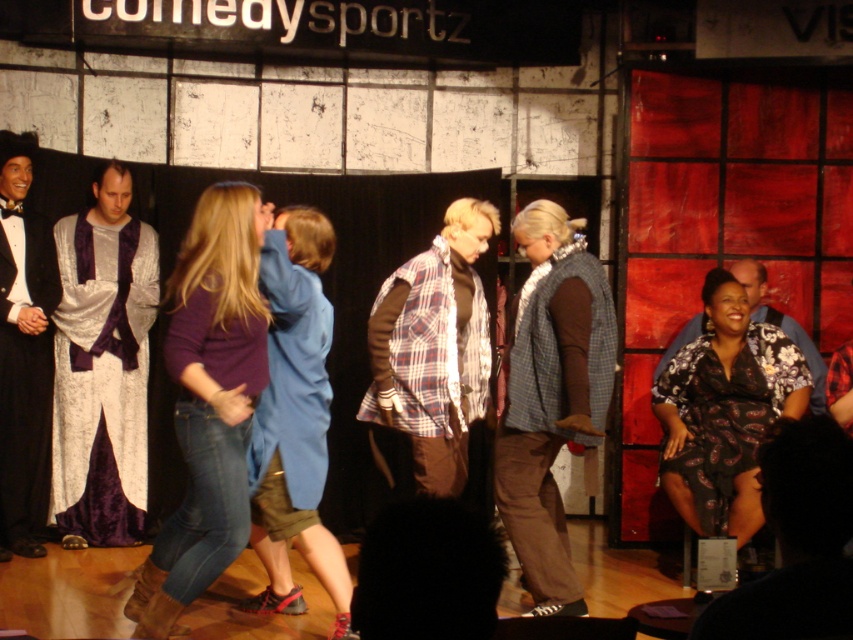
You are sitting in the audience of the ComedySportz club and notice two performers on stage. One is wearing a black velvet tuxedo at left and the other a floral fabric shirt at right. Which performer is standing closer to the front of the stage?

The black velvet tuxedo at left is closer to the viewer than the floral fabric shirt at right, so the performer in the black velvet tuxedo at left is standing closer to the front of the stage.

You are a photographer at the ComedySportz club and need to capture a photo of both the black velvet tuxedo at left and the floral fabric shirt at right. Which performer should you focus on first if you want to include both in the frame without moving the camera?

The black velvet tuxedo at left is positioned on the left side of the floral fabric shirt at right, so you should focus on the black velvet tuxedo at left first to ensure both are in the frame.

You are a photographer positioned at the back of the ComedySportz club, and you need to capture a photo of both the plaid fabric shirt at center and the floral fabric shirt at right. Which shirt should you focus on first to ensure both are in frame?

The plaid fabric shirt at center has a greater height compared to the floral fabric shirt at right, so you should focus on the plaid fabric shirt at center first to ensure both are in frame.